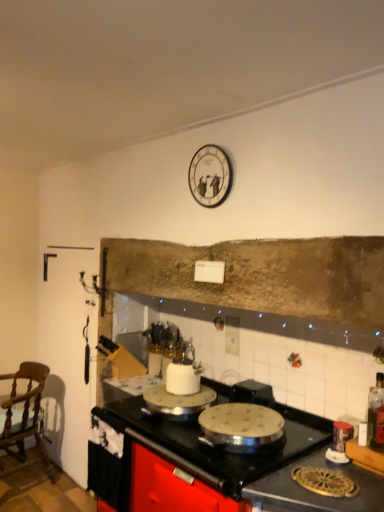
Question: Does metallic silver canister at lower right appear on the left side of wooden chair at left?

Choices:
 (A) no
 (B) yes

Answer: (A)

Question: From a real-world perspective, is metallic silver canister at lower right located higher than wooden chair at left?

Choices:
 (A) no
 (B) yes

Answer: (B)

Question: Is metallic silver canister at lower right located outside wooden chair at left?

Choices:
 (A) no
 (B) yes

Answer: (B)

Question: Is metallic silver canister at lower right bigger than wooden chair at left?

Choices:
 (A) yes
 (B) no

Answer: (B)

Question: From a real-world perspective, is metallic silver canister at lower right beneath wooden chair at left?

Choices:
 (A) yes
 (B) no

Answer: (B)

Question: Considering the relative sizes of metallic silver canister at lower right and wooden chair at left in the image provided, is metallic silver canister at lower right taller than wooden chair at left?

Choices:
 (A) yes
 (B) no

Answer: (B)

Question: Is metallic silver canister at lower right to the right of white glossy clock at upper center from the viewer's perspective?

Choices:
 (A) no
 (B) yes

Answer: (B)

Question: Is metallic silver canister at lower right not inside white glossy clock at upper center?

Choices:
 (A) yes
 (B) no

Answer: (A)

Question: Does metallic silver canister at lower right have a lesser width compared to white glossy clock at upper center?

Choices:
 (A) no
 (B) yes

Answer: (A)

Question: Considering the relative sizes of metallic silver canister at lower right and white glossy clock at upper center in the image provided, is metallic silver canister at lower right bigger than white glossy clock at upper center?

Choices:
 (A) no
 (B) yes

Answer: (A)

Question: Is metallic silver canister at lower right at the left side of white glossy clock at upper center?

Choices:
 (A) no
 (B) yes

Answer: (A)

Question: Considering the relative sizes of metallic silver canister at lower right and white glossy clock at upper center in the image provided, is metallic silver canister at lower right shorter than white glossy clock at upper center?

Choices:
 (A) no
 (B) yes

Answer: (B)

Question: Is wooden chair at left placed right next to white glossy clock at upper center?

Choices:
 (A) yes
 (B) no

Answer: (B)